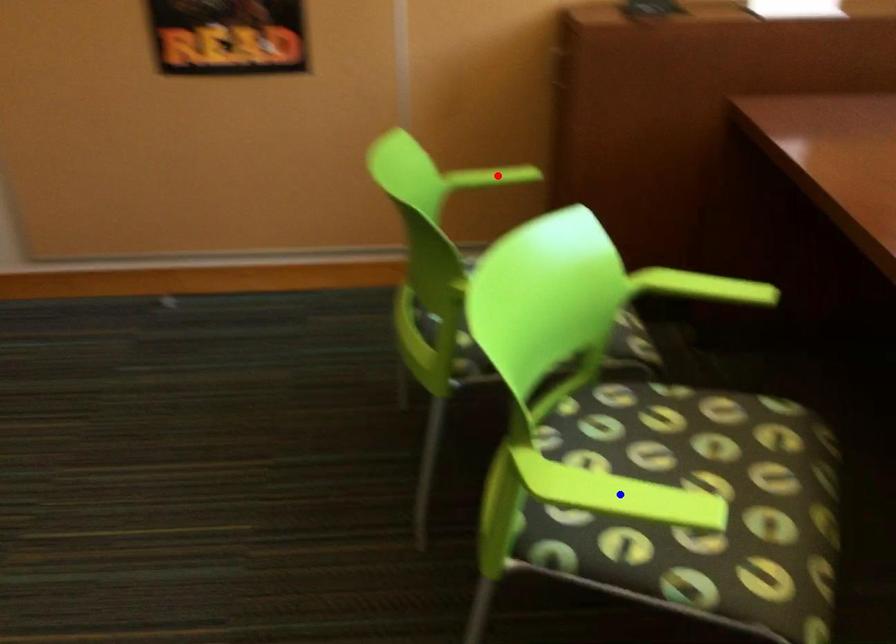
Question: In the image, two points are highlighted. Which point is nearer to the camera? Reply with the corresponding letter.

Choices:
 (A) blue point
 (B) red point

Answer: (A)